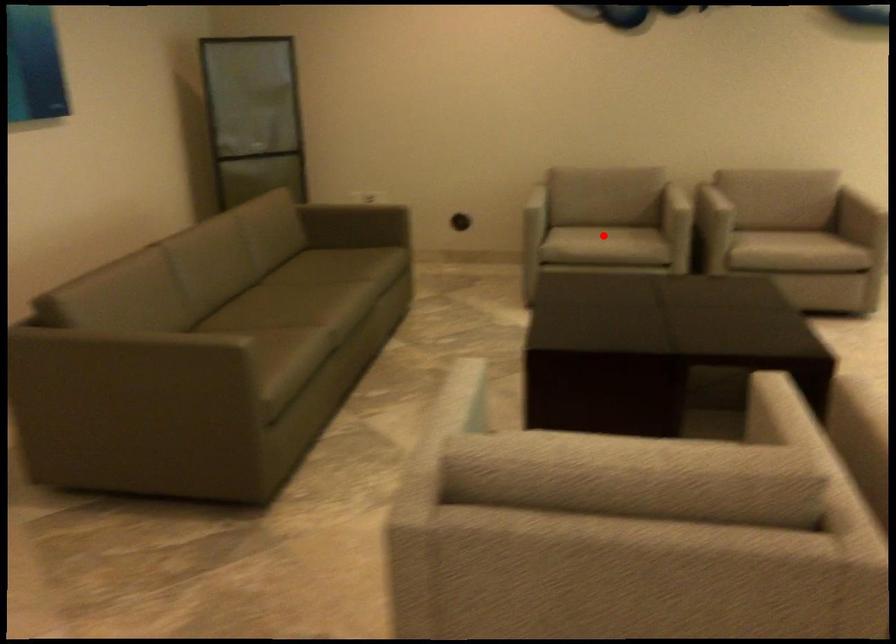
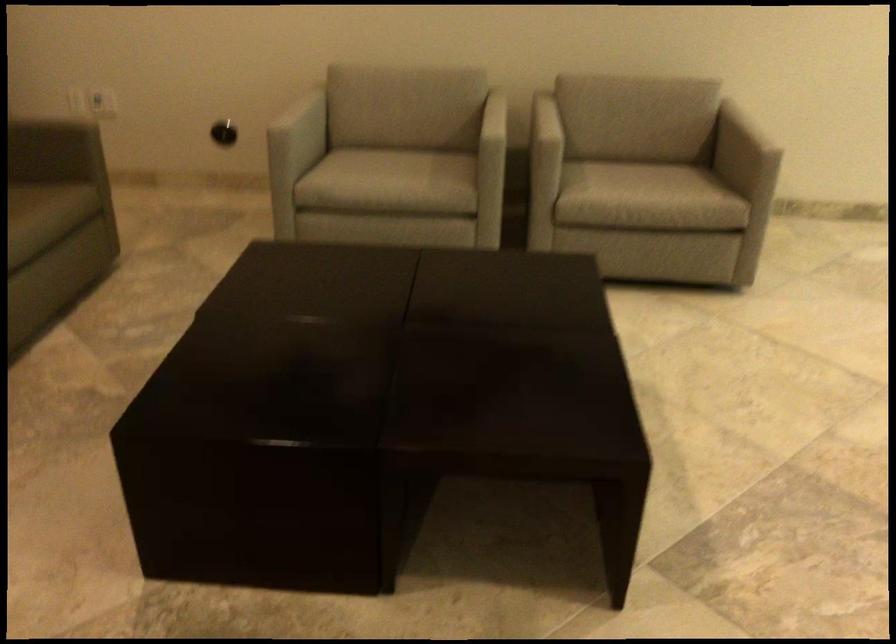
Find the pixel in the second image that matches the highlighted location in the first image.

(390, 176)